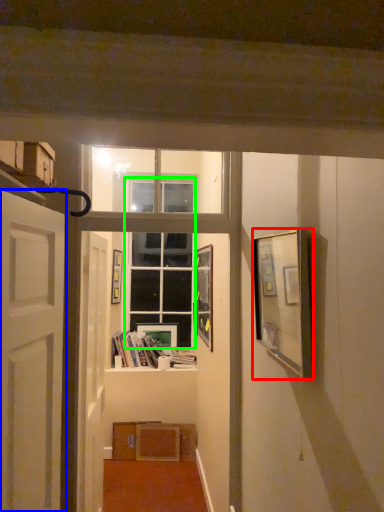
Question: Which object is positioned farthest from picture frame (highlighted by a red box)? Select from door (highlighted by a blue box) and glass door (highlighted by a green box).

Choices:
 (A) door
 (B) glass door

Answer: (B)